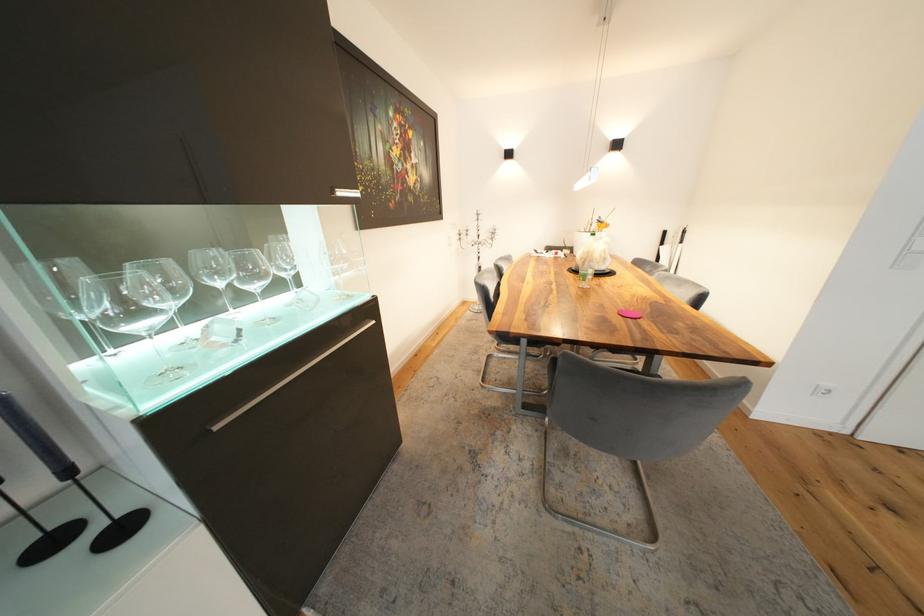
Identify the location of silver candelabra. This screenshot has height=616, width=924. (476, 245).